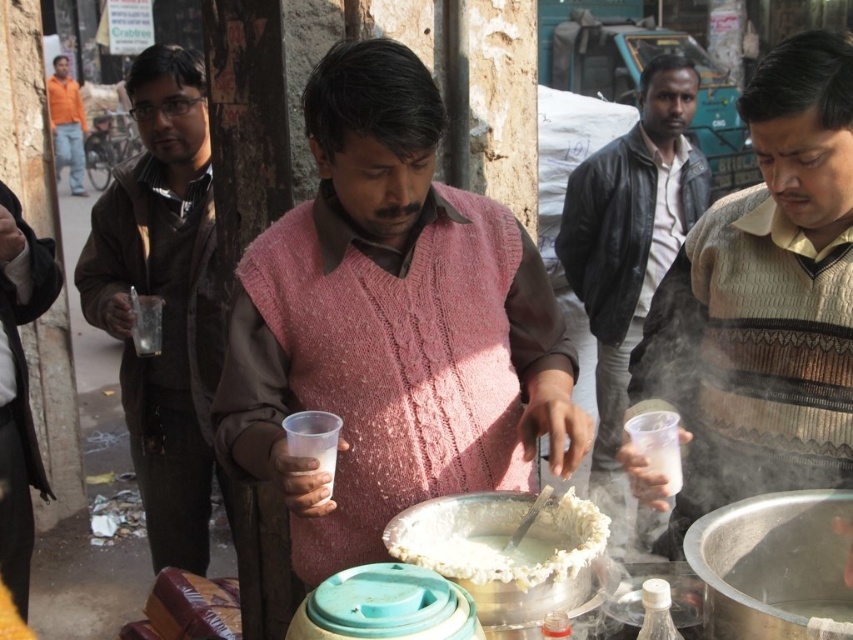
Question: Which point is closer to the camera taking this photo?

Choices:
 (A) (811, 340)
 (B) (595, 493)
 (C) (527, 534)
 (D) (132, 205)

Answer: (C)

Question: Which point is farther from the camera taking this photo?

Choices:
 (A) (248, 317)
 (B) (595, 529)

Answer: (A)

Question: Can you confirm if knitted sweater at center is bigger than white creamy food at center?

Choices:
 (A) yes
 (B) no

Answer: (A)

Question: Which of the following is the closest to the observer?

Choices:
 (A) (300, 544)
 (B) (200, 412)
 (C) (619, 348)

Answer: (A)

Question: Does leather jacket at center lie behind white creamy food at center?

Choices:
 (A) yes
 (B) no

Answer: (A)

Question: Does pink knitted sweater at center have a greater width compared to knitted sweater at center?

Choices:
 (A) yes
 (B) no

Answer: (A)